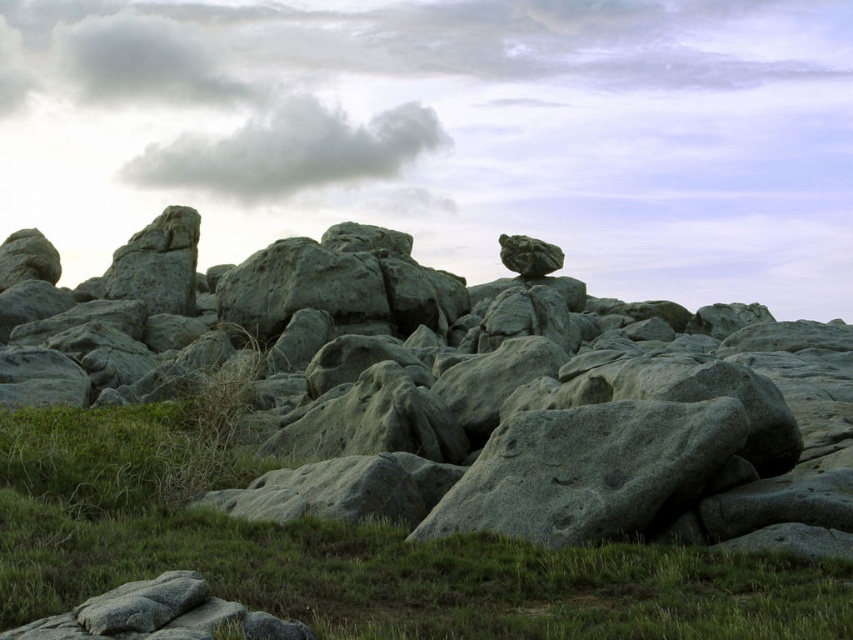
Question: Which point is closer to the camera?

Choices:
 (A) gray fluffy cloud at upper center
 (B) green grassy at lower center
 (C) gray rough rock at center

Answer: (B)

Question: Does gray rough rock at center have a smaller size compared to gray fluffy cloud at upper center?

Choices:
 (A) no
 (B) yes

Answer: (A)

Question: Which of the following is the farthest from the observer?

Choices:
 (A) (657, 412)
 (B) (9, 481)

Answer: (B)

Question: Does gray rough rock at center appear over green grassy at lower center?

Choices:
 (A) no
 (B) yes

Answer: (B)

Question: Which object is positioned farthest from the gray fluffy cloud at upper center?

Choices:
 (A) gray rough rock at center
 (B) green grassy at lower center

Answer: (B)

Question: Is green grassy at lower center below gray fluffy cloud at upper center?

Choices:
 (A) yes
 (B) no

Answer: (A)